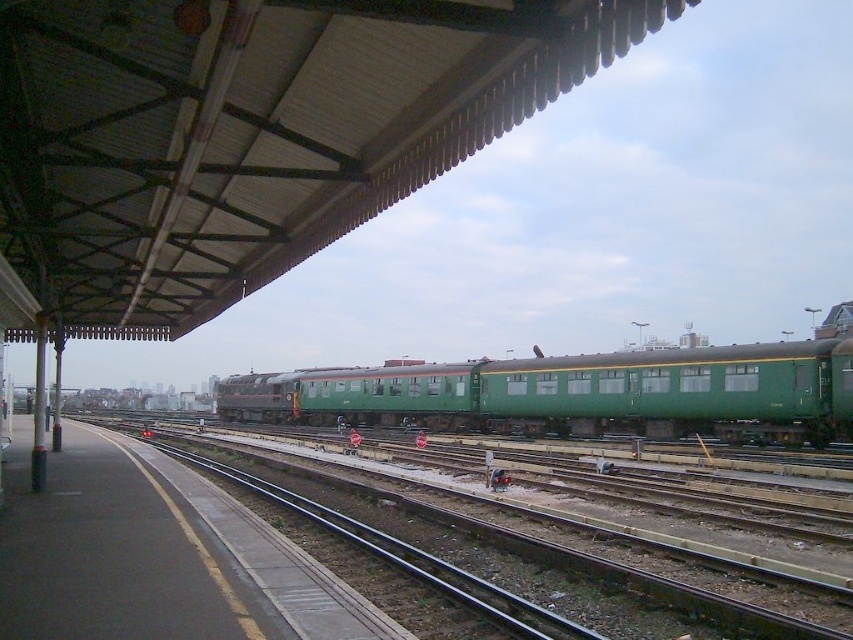
Question: Does green matte train car at center appear on the left side of green metal track at center?

Choices:
 (A) yes
 (B) no

Answer: (B)

Question: Can you confirm if green matte train car at center is positioned to the left of green metal track at center?

Choices:
 (A) yes
 (B) no

Answer: (B)

Question: Is green matte train car at center smaller than green metal track at center?

Choices:
 (A) no
 (B) yes

Answer: (A)